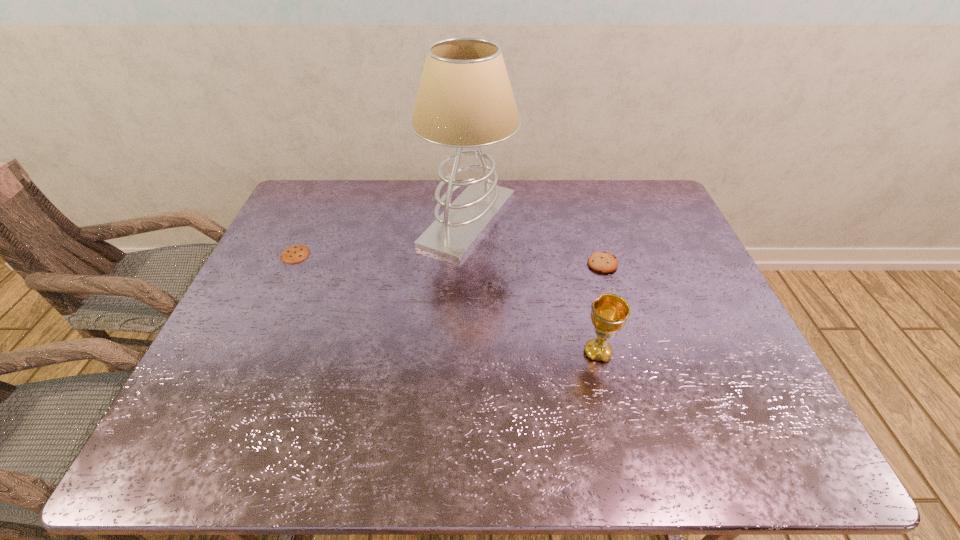
Identify the location of free spot between the nearest object and the shorter cookie. (446, 303).

Where is `vacant space that is in between the shorter cookie and the nearest object`? This screenshot has height=540, width=960. vacant space that is in between the shorter cookie and the nearest object is located at coordinates (446, 303).

This screenshot has width=960, height=540. Identify the location of free space between the chalice and the second object from left to right. (533, 286).

The image size is (960, 540). What are the coordinates of `vacant space in between the shorter cookie and the second tallest object` in the screenshot? It's located at coord(446,303).

I want to click on free spot between the shorter cookie and the right cookie, so click(x=449, y=259).

The image size is (960, 540). In order to click on vacant point located between the chalice and the leftmost object in this screenshot , I will do `click(446, 303)`.

At what (x,y) coordinates should I click in order to perform the action: click on free area in between the leftmost object and the taller cookie. Please return your answer as a coordinate pair (x, y). The width and height of the screenshot is (960, 540). Looking at the image, I should click on (449, 259).

Locate which object is the closest to the chalice. Please provide its 2D coordinates. Your answer should be formatted as a tuple, i.e. [(x, y)], where the tuple contains the x and y coordinates of a point satisfying the conditions above.

[(604, 262)]

Image resolution: width=960 pixels, height=540 pixels. What are the coordinates of `object that ranks as the second closest to the tallest object` in the screenshot? It's located at (609, 313).

The image size is (960, 540). I want to click on vacant point that satisfies the following two spatial constraints: 1. on the front side of the leftmost object; 2. on the right side of the third shortest object, so click(251, 353).